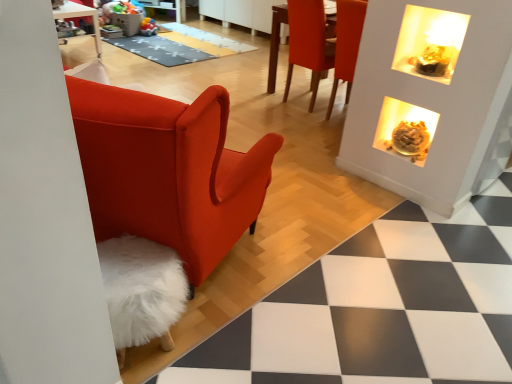
Question: From a real-world perspective, is matte orange chair at upper right positioned above or below gray textured mat at center?

Choices:
 (A) above
 (B) below

Answer: (A)

Question: Which is correct: matte orange chair at upper right is inside gray textured mat at center, or outside of it?

Choices:
 (A) outside
 (B) inside

Answer: (A)

Question: Which object is the farthest from the gray textured mat at center?

Choices:
 (A) translucent glass bowl at upper right
 (B) matte orange chair at upper right

Answer: (A)

Question: Which object is the closest to the gray textured mat at center?

Choices:
 (A) translucent glass bowl at upper right
 (B) matte orange chair at upper right

Answer: (B)